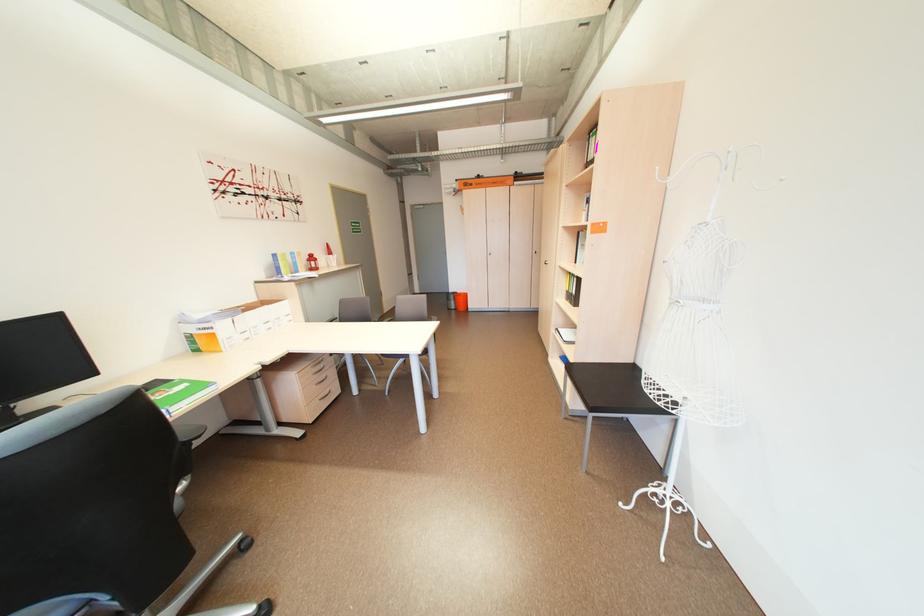
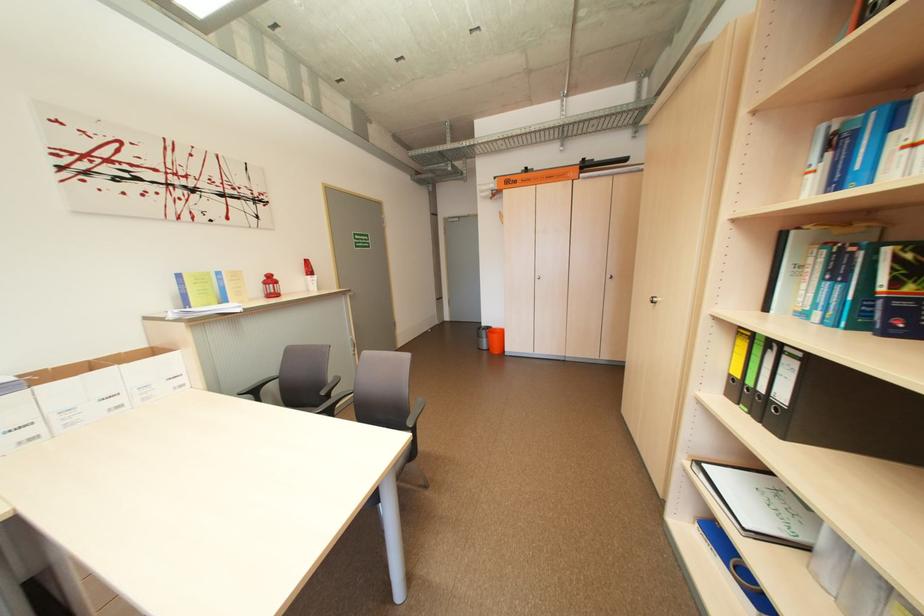
Question: I am providing you with two images of the same scene from different viewpoints. Please identify which objects are invisible in image2.

Choices:
 (A) small red lantern
 (B) plaid window curtain
 (C) chair sitting surface
 (D) white cardboard box

Answer: (C)